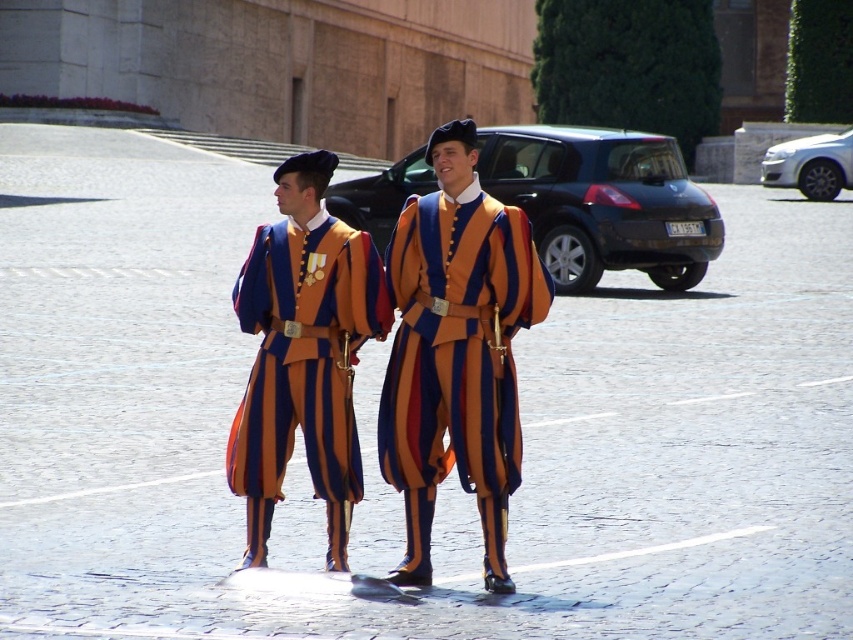
Question: Among these objects, which one is farthest from the camera?

Choices:
 (A) matte striped uniform at center
 (B) orange and blue striped uniform at center

Answer: (A)

Question: Can you confirm if orange and blue striped uniform at center is positioned to the right of matte striped uniform at center?

Choices:
 (A) yes
 (B) no

Answer: (A)

Question: Is orange and blue striped uniform at center to the left of matte striped uniform at center from the viewer's perspective?

Choices:
 (A) yes
 (B) no

Answer: (B)

Question: Which object appears closest to the camera in this image?

Choices:
 (A) matte striped uniform at center
 (B) orange and blue striped uniform at center

Answer: (B)

Question: Does orange and blue striped uniform at center have a greater width compared to matte striped uniform at center?

Choices:
 (A) no
 (B) yes

Answer: (B)